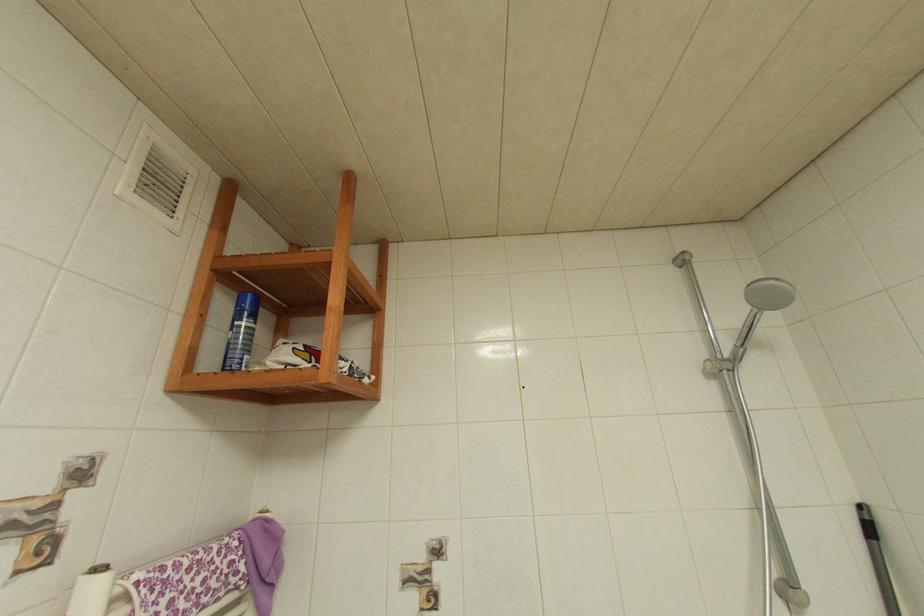
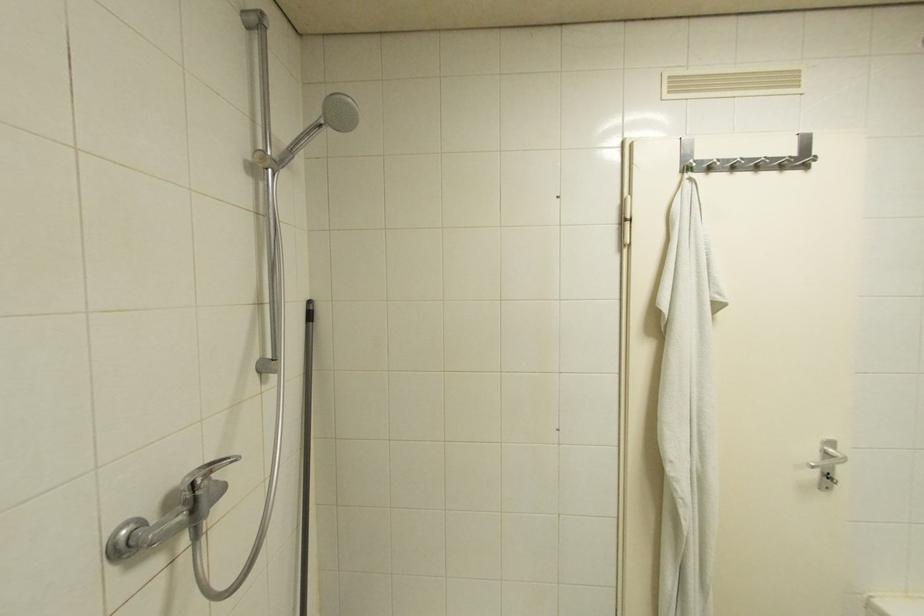
Question: Based on the continuous images, in which direction is the camera rotating? Reply with the corresponding letter.

Choices:
 (A) Left
 (B) Right
 (C) Up
 (D) Down

Answer: (B)